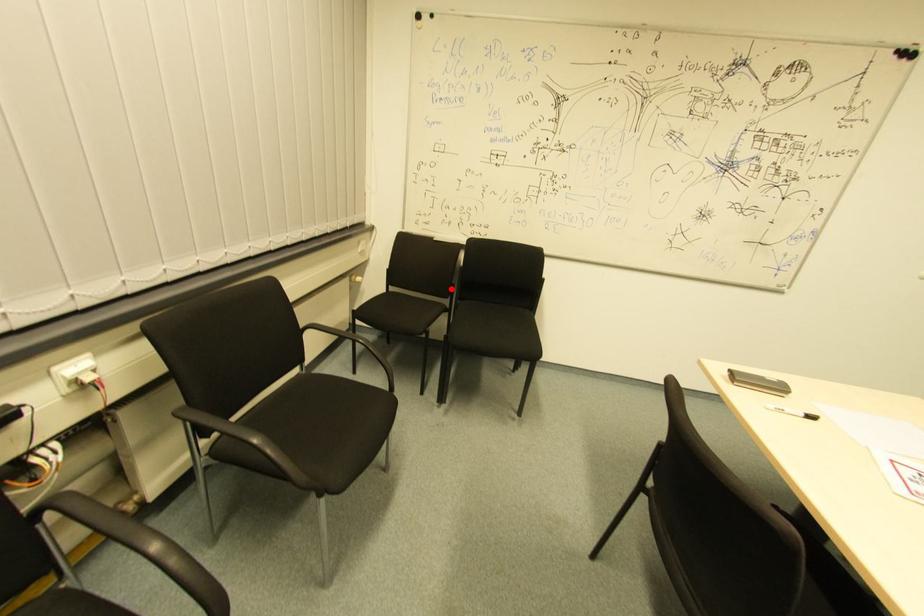
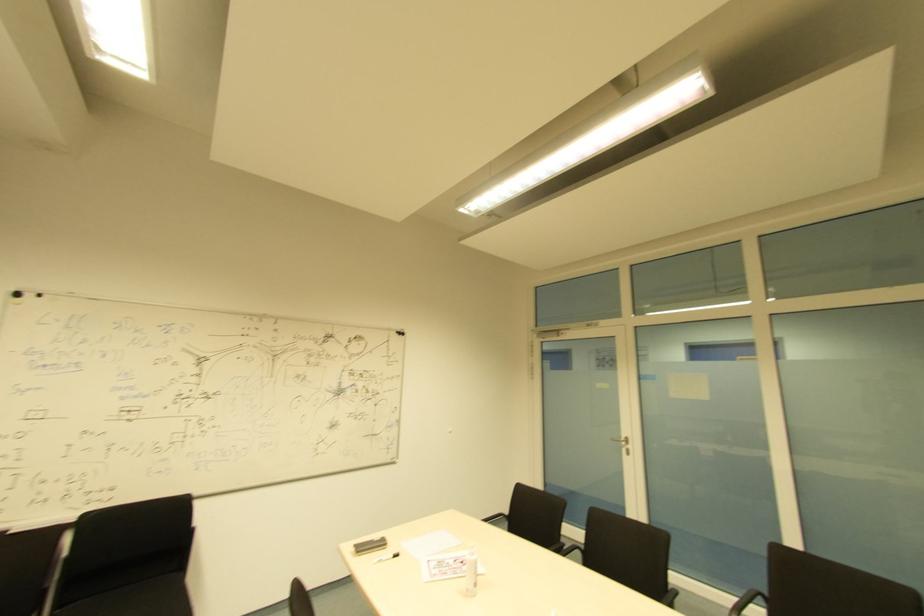
Where in the second image is the point corresponding to the highlighted location from the first image?

(44, 593)